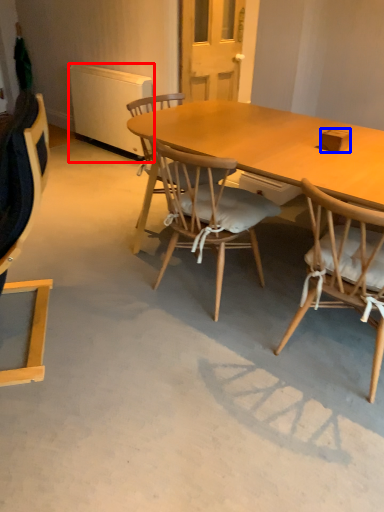
Question: Which object appears closest to the camera in this image, radiator (highlighted by a red box) or box (highlighted by a blue box)?

Choices:
 (A) radiator
 (B) box

Answer: (B)